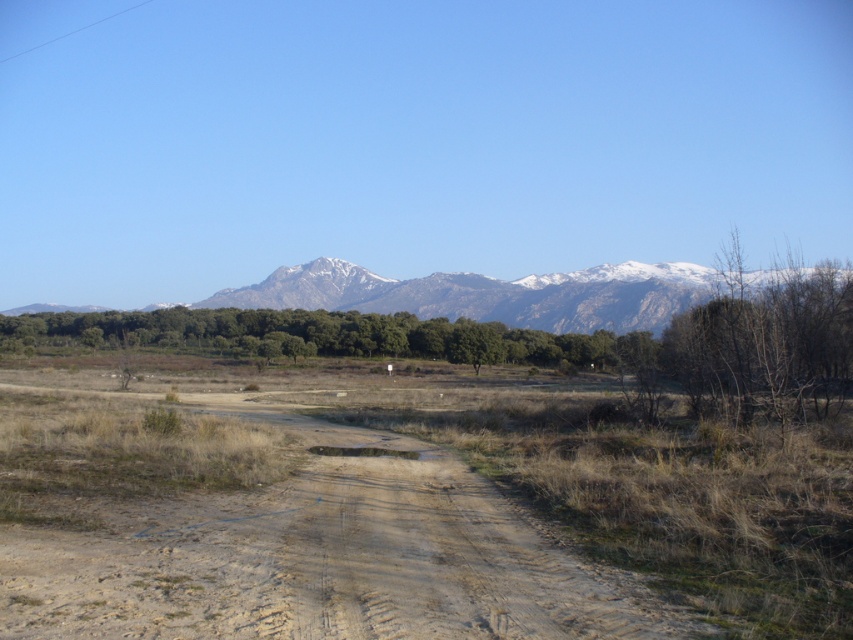
Question: Which of the following is the farthest from the observer?

Choices:
 (A) (465, 276)
 (B) (224, 566)

Answer: (A)

Question: Does brown sandy dirt track at center appear on the right side of snowy granite mountain range at upper center?

Choices:
 (A) yes
 (B) no

Answer: (B)

Question: Where is brown sandy dirt track at center located in relation to snowy granite mountain range at upper center in the image?

Choices:
 (A) right
 (B) left

Answer: (B)

Question: Which object appears farthest from the camera in this image?

Choices:
 (A) brown sandy dirt track at center
 (B) snowy granite mountain range at upper center

Answer: (B)

Question: Where is brown sandy dirt track at center located in relation to snowy granite mountain range at upper center in the image?

Choices:
 (A) left
 (B) right

Answer: (A)